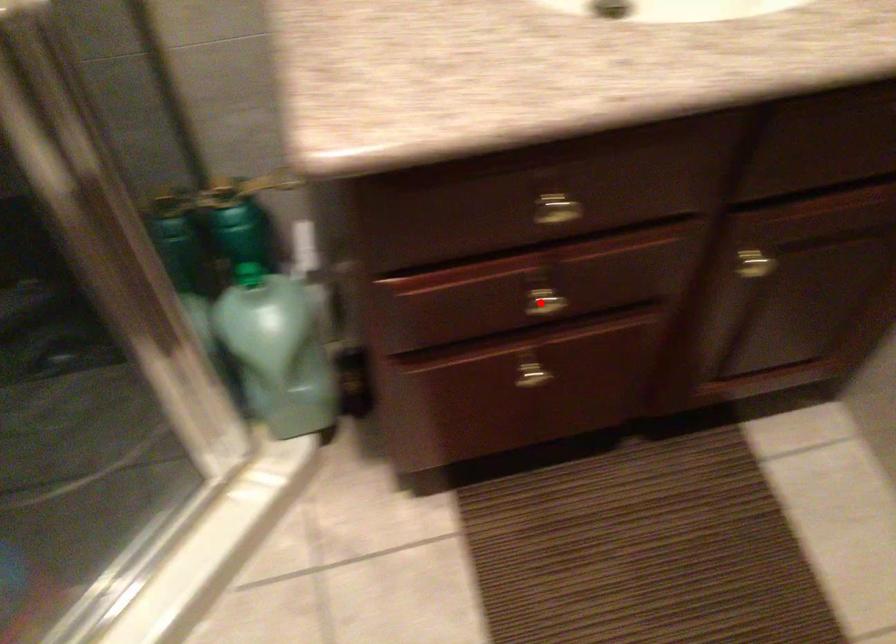
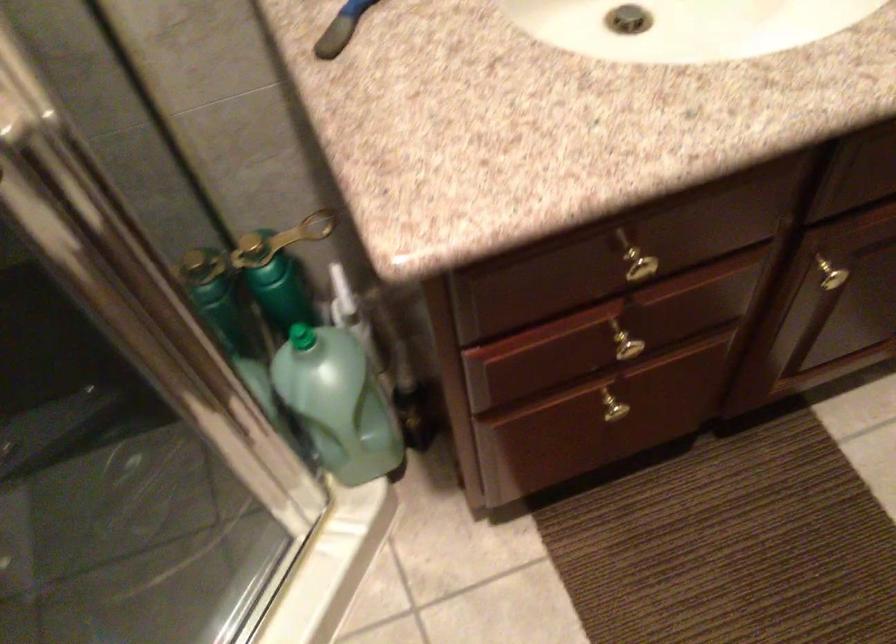
In the second image, find the point that corresponds to the highlighted location in the first image.

(625, 346)